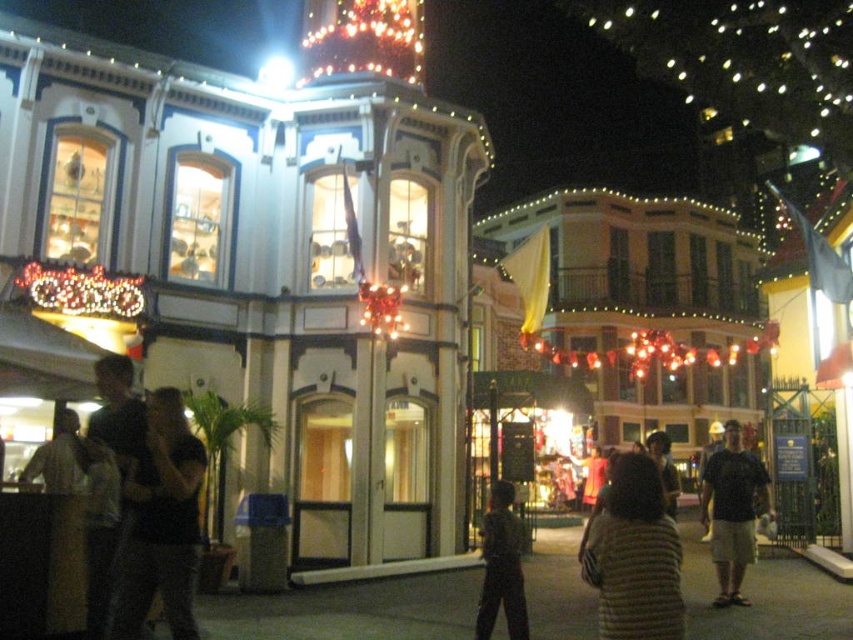
Question: Is dark clothing at left below striped fabric at center?

Choices:
 (A) no
 (B) yes

Answer: (A)

Question: Which of the following is the closest to the observer?

Choices:
 (A) (747, 476)
 (B) (154, 538)
 (C) (608, 547)
 (D) (347, 61)

Answer: (C)

Question: Is striped fabric at center closer to camera compared to dark gray shirt at left?

Choices:
 (A) yes
 (B) no

Answer: (A)

Question: Based on their relative distances, which object is nearer to the dark gray t-shirt at lower right?

Choices:
 (A) illuminated glass christmas lights at upper center
 (B) striped fabric at center
 (C) dark gray shirt at left

Answer: (B)

Question: Which of the following is the farthest from the observer?

Choices:
 (A) (502, 504)
 (B) (51, 483)
 (C) (345, 29)
 (D) (619, 593)

Answer: (C)

Question: Can you confirm if dark clothing at left is positioned below illuminated glass christmas lights at upper center?

Choices:
 (A) yes
 (B) no

Answer: (A)